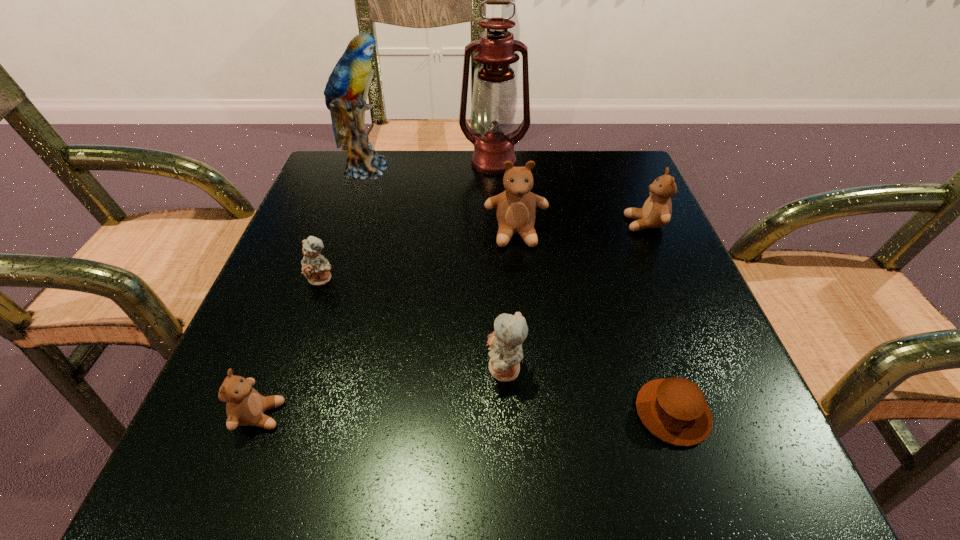
Where is `the smallest brown teddy bear`? Image resolution: width=960 pixels, height=540 pixels. the smallest brown teddy bear is located at coordinates pos(245,406).

The image size is (960, 540). I want to click on the nearest teddy bear, so click(x=245, y=406).

Locate an element on the screen. Image resolution: width=960 pixels, height=540 pixels. muffin is located at coordinates (675, 410).

At what (x,y) coordinates should I click in order to perform the action: click on brown muffin. Please return your answer as a coordinate pair (x, y). This screenshot has width=960, height=540. Looking at the image, I should click on (675, 410).

The height and width of the screenshot is (540, 960). What are the coordinates of `blank space located on the right of the oil lamp` in the screenshot? It's located at (622, 163).

Identify the location of vacant space located on the face of the seventh shortest object. The image size is (960, 540). (501, 169).

This screenshot has height=540, width=960. What are the coordinates of `blank space located on the front-facing side of the sixth shortest object` in the screenshot? It's located at (532, 415).

Locate an element on the screen. This screenshot has width=960, height=540. free spot located on the front-facing side of the rightmost teddy bear is located at coordinates (508, 224).

At what (x,y) coordinates should I click in order to perform the action: click on free location located on the front-facing side of the rightmost teddy bear. Please return your answer as a coordinate pair (x, y). The height and width of the screenshot is (540, 960). Looking at the image, I should click on (468, 224).

In order to click on vacant space located on the front-facing side of the rightmost teddy bear in this screenshot , I will do tap(454, 224).